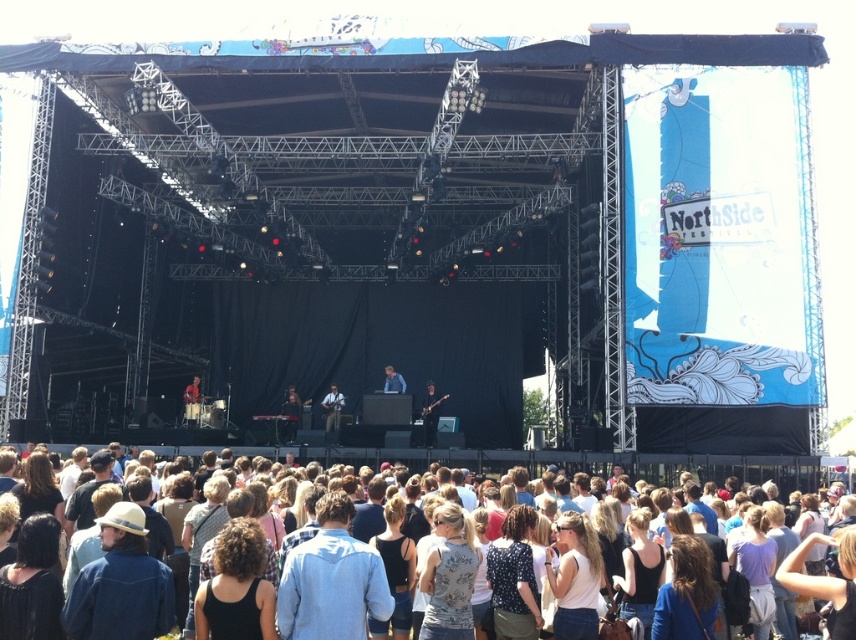
Question: Does natural hair at lower center have a lesser width compared to light brown leather guitar at center?

Choices:
 (A) no
 (B) yes

Answer: (A)

Question: Which point is farther from the camera taking this photo?

Choices:
 (A) (337, 392)
 (B) (300, 410)

Answer: (B)

Question: Can you confirm if metallic guitar at center is positioned to the left of light brown leather guitar at center?

Choices:
 (A) yes
 (B) no

Answer: (A)

Question: Is natural hair at lower center above matte black drum set at center?

Choices:
 (A) yes
 (B) no

Answer: (B)

Question: Which point is closer to the camera?

Choices:
 (A) matte black guitar at center
 (B) blue denim shirt at center
 (C) matte black drum set at center

Answer: (B)

Question: Which point is farther to the camera?

Choices:
 (A) (281, 435)
 (B) (333, 433)
 (C) (393, 371)

Answer: (C)